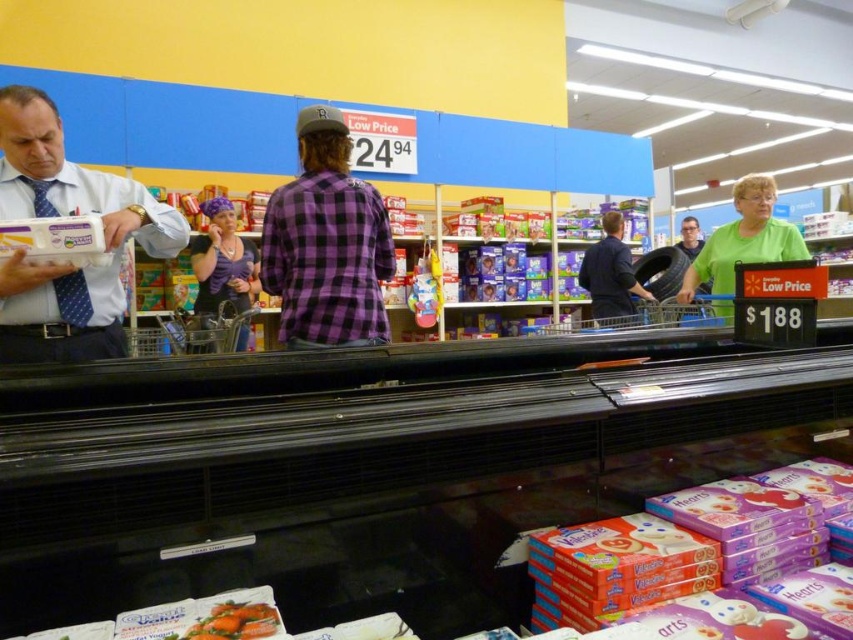
The image size is (853, 640). Describe the element at coordinates (67, 264) in the screenshot. I see `matte blue tie at left` at that location.

From the picture: Can you confirm if matte blue tie at left is shorter than green matte shirt at upper right?

In fact, matte blue tie at left may be taller than green matte shirt at upper right.

Is point (57, 344) positioned in front of point (724, 273)?

Yes.

Where is `matte blue tie at left`? The height and width of the screenshot is (640, 853). matte blue tie at left is located at coordinates (67, 264).

Which is below, matte blue tie at left or purple plaid shirt at center?

matte blue tie at left

Is matte blue tie at left to the right of purple plaid shirt at center from the viewer's perspective?

Yes, matte blue tie at left is to the right of purple plaid shirt at center.

Who is more distant from viewer, (55, 269) or (218, 227)?

Positioned behind is point (218, 227).

The height and width of the screenshot is (640, 853). In order to click on matte blue tie at left in this screenshot , I will do `click(67, 264)`.

The width and height of the screenshot is (853, 640). What do you see at coordinates (223, 262) in the screenshot? I see `purple plaid shirt at center` at bounding box center [223, 262].

Who is more distant from viewer, (207, 202) or (619, 224)?

The point (619, 224) is more distant.

Between point (204, 308) and point (625, 304), which one is positioned in front?

Positioned in front is point (204, 308).

You are a GUI agent. You are given a task and a screenshot of the screen. Output one action in this format:
    pyautogui.click(x=<x>, y=<y>)
    Task: Click on the purple plaid shirt at center
    This screenshot has width=853, height=640.
    Given the screenshot: What is the action you would take?
    pos(223,262)